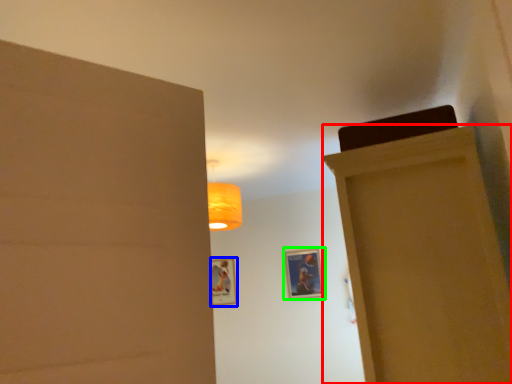
Question: Considering the real-world distances, which object is farthest from door (highlighted by a red box)? picture frame (highlighted by a blue box) or picture frame (highlighted by a green box)?

Choices:
 (A) picture frame
 (B) picture frame

Answer: (A)